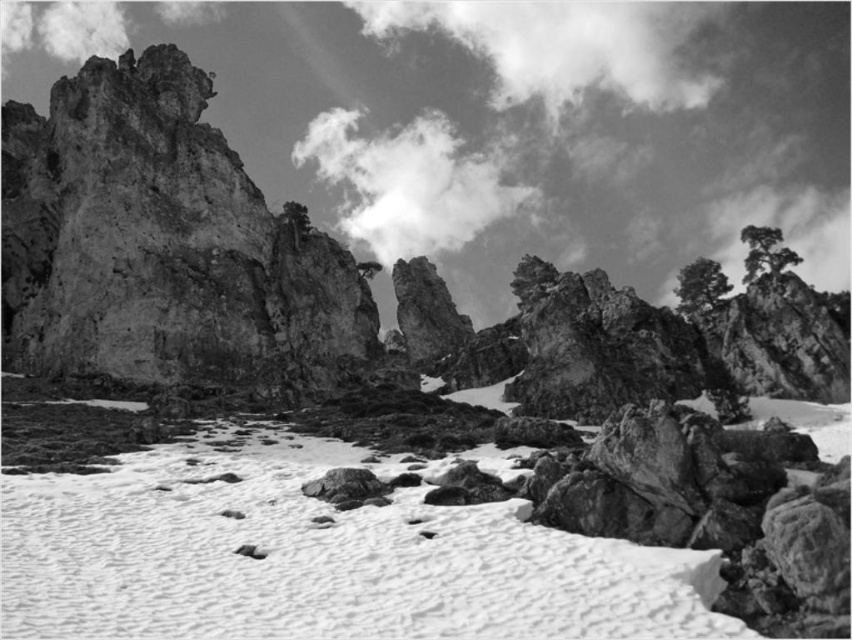
Question: Among these objects, which one is nearest to the camera?

Choices:
 (A) fuzzy white cloud at upper center
 (B) cloudy sky at upper center
 (C) white textured snow at center

Answer: (C)

Question: Which of the following is the closest to the observer?

Choices:
 (A) fuzzy white cloud at upper center
 (B) cloudy sky at upper center

Answer: (B)

Question: Can you confirm if white textured snow at center is thinner than fuzzy white cloud at upper center?

Choices:
 (A) yes
 (B) no

Answer: (A)

Question: Is fuzzy white cloud at upper center closer to the viewer compared to cloudy sky at upper center?

Choices:
 (A) no
 (B) yes

Answer: (A)

Question: Which object is closer to the camera taking this photo?

Choices:
 (A) cloudy sky at upper center
 (B) white textured snow at center
 (C) fuzzy white cloud at upper center

Answer: (B)

Question: Does white textured snow at center have a larger size compared to cloudy sky at upper center?

Choices:
 (A) no
 (B) yes

Answer: (A)